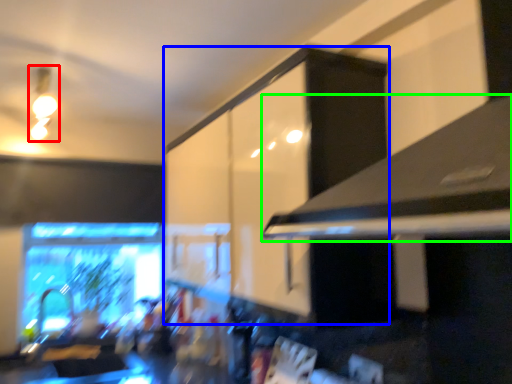
Question: Considering the real-world distances, which object is farthest from light fixture (highlighted by a red box)? cabinetry (highlighted by a blue box) or exhaust hood (highlighted by a green box)?

Choices:
 (A) cabinetry
 (B) exhaust hood

Answer: (B)